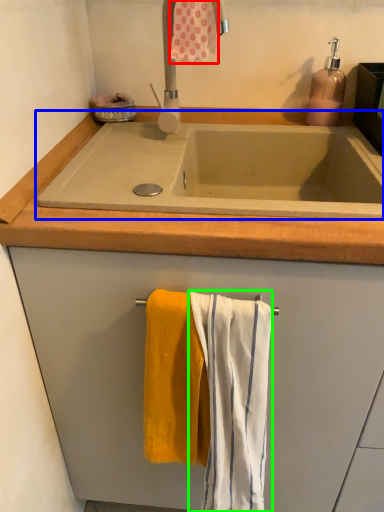
Question: Considering the real-world distances, which object is closest to bath towel (highlighted by a red box)? bath (highlighted by a blue box) or bath towel (highlighted by a green box).

Choices:
 (A) bath
 (B) bath towel

Answer: (A)